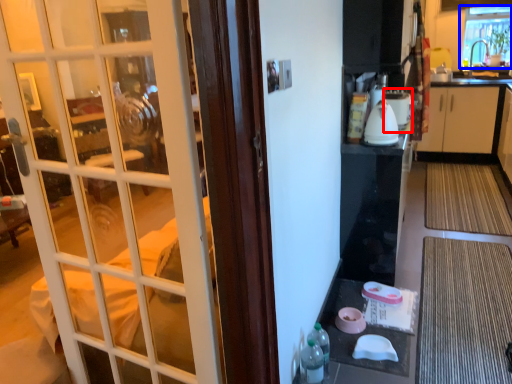
Question: Which object appears farthest to the camera in this image, appliance (highlighted by a red box) or window (highlighted by a blue box)?

Choices:
 (A) appliance
 (B) window

Answer: (B)